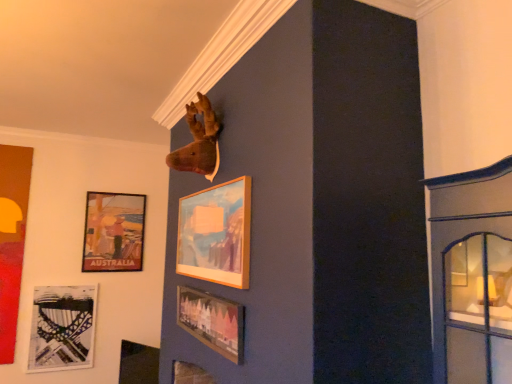
At what (x,y) coordinates should I click in order to perform the action: click on matte black picture frame at lower left, which is the 3th picture frame in back-to-front order. Please return your answer as a coordinate pair (x, y). This screenshot has height=384, width=512. Looking at the image, I should click on (138, 364).

Locate an element on the screen. This screenshot has height=384, width=512. matte black harp at lower left, the 4th picture frame in the front-to-back sequence is located at coordinates (62, 328).

What is the approximate height of wooden frame at upper center, which appears as the 4th picture frame when viewed from the back?

The height of wooden frame at upper center, which appears as the 4th picture frame when viewed from the back, is 19.84 inches.

Locate an element on the screen. matte wooden picture frame at lower center, which is the 1th picture frame from front to back is located at coordinates (212, 321).

You are a GUI agent. You are given a task and a screenshot of the screen. Output one action in this format:
    pyautogui.click(x=<x>, y=<y>)
    Task: Click on the matte cardboard poster at upper left, placed as the fifth picture frame when sorted from front to back
    The height and width of the screenshot is (384, 512).
    Given the screenshot: What is the action you would take?
    pyautogui.click(x=113, y=232)

In terms of height, does matte wooden picture frame at lower center, arranged as the 5th picture frame when viewed from the back, look taller or shorter compared to matte black picture frame at lower left, which is the 3th picture frame in back-to-front order?

Considering their sizes, matte wooden picture frame at lower center, arranged as the 5th picture frame when viewed from the back, has less height than matte black picture frame at lower left, which is the 3th picture frame in back-to-front order.

Between matte wooden picture frame at lower center, which is the 1th picture frame from front to back, and matte black picture frame at lower left, acting as the 3th picture frame starting from the front, which one appears on the right side from the viewer's perspective?

From the viewer's perspective, matte wooden picture frame at lower center, which is the 1th picture frame from front to back, appears more on the right side.

Measure the distance between matte wooden picture frame at lower center, arranged as the 5th picture frame when viewed from the back, and matte black picture frame at lower left, acting as the 3th picture frame starting from the front.

The distance of matte wooden picture frame at lower center, arranged as the 5th picture frame when viewed from the back, from matte black picture frame at lower left, acting as the 3th picture frame starting from the front, is 5.16 feet.

Can we say matte wooden picture frame at lower center, arranged as the 5th picture frame when viewed from the back, lies outside matte black picture frame at lower left, which is the 3th picture frame in back-to-front order?

Yes, matte wooden picture frame at lower center, arranged as the 5th picture frame when viewed from the back, is located beyond the bounds of matte black picture frame at lower left, which is the 3th picture frame in back-to-front order.

Is matte wooden picture frame at lower center, which is the 1th picture frame from front to back, placed right next to matte cardboard poster at upper left, placed as the fifth picture frame when sorted from front to back?

matte wooden picture frame at lower center, which is the 1th picture frame from front to back, and matte cardboard poster at upper left, placed as the fifth picture frame when sorted from front to back, are clearly separated.

Is matte wooden picture frame at lower center, which is the 1th picture frame from front to back, in front of or behind matte cardboard poster at upper left, placed as the fifth picture frame when sorted from front to back, in the image?

matte wooden picture frame at lower center, which is the 1th picture frame from front to back, is in front of matte cardboard poster at upper left, placed as the fifth picture frame when sorted from front to back.

At what (x,y) coordinates should I click in order to perform the action: click on the 2nd picture frame directly above the matte wooden picture frame at lower center, arranged as the 5th picture frame when viewed from the back (from a real-world perspective). Please return your answer as a coordinate pair (x, y). Looking at the image, I should click on (113, 232).

Can you confirm if matte wooden picture frame at lower center, arranged as the 5th picture frame when viewed from the back, is thinner than matte cardboard poster at upper left, the first picture frame positioned from the back?

Indeed, matte wooden picture frame at lower center, arranged as the 5th picture frame when viewed from the back, has a lesser width compared to matte cardboard poster at upper left, the first picture frame positioned from the back.

From the image's perspective, does matte black harp at lower left, the 4th picture frame in the front-to-back sequence, appear lower than wooden frame at upper center, the 2th picture frame viewed from the front?

Indeed, from the image's perspective, matte black harp at lower left, the 4th picture frame in the front-to-back sequence, is shown beneath wooden frame at upper center, the 2th picture frame viewed from the front.

Does matte black harp at lower left, the 4th picture frame in the front-to-back sequence, have a lesser width compared to wooden frame at upper center, the 2th picture frame viewed from the front?

In fact, matte black harp at lower left, the 4th picture frame in the front-to-back sequence, might be wider than wooden frame at upper center, the 2th picture frame viewed from the front.

Considering the points (80, 332) and (243, 230), which point is in front, point (80, 332) or point (243, 230)?

Positioned in front is point (243, 230).

Is wooden frame at upper center, which appears as the 4th picture frame when viewed from the back, a part of matte black harp at lower left, which is counted as the second picture frame, starting from the back?

No.

Looking at this image, from the image's perspective, is matte black harp at lower left, which is counted as the second picture frame, starting from the back, above matte black picture frame at lower left, which is the 3th picture frame in back-to-front order?

Yes, from the image's perspective, matte black harp at lower left, which is counted as the second picture frame, starting from the back, is above matte black picture frame at lower left, which is the 3th picture frame in back-to-front order.

Image resolution: width=512 pixels, height=384 pixels. What are the coordinates of `picture frame that is the 2nd one when counting leftward from the matte black picture frame at lower left, which is the 3th picture frame in back-to-front order` in the screenshot? It's located at (62, 328).

Does matte black harp at lower left, the 4th picture frame in the front-to-back sequence, have a greater height compared to matte black picture frame at lower left, which is the 3th picture frame in back-to-front order?

Indeed, matte black harp at lower left, the 4th picture frame in the front-to-back sequence, has a greater height compared to matte black picture frame at lower left, which is the 3th picture frame in back-to-front order.

Could you tell me if matte black harp at lower left, the 4th picture frame in the front-to-back sequence, is turned towards matte black picture frame at lower left, acting as the 3th picture frame starting from the front?

No.

Would you consider matte wooden picture frame at lower center, which is the 1th picture frame from front to back, to be distant from wooden frame at upper center, the 2th picture frame viewed from the front?

matte wooden picture frame at lower center, which is the 1th picture frame from front to back, is actually quite close to wooden frame at upper center, the 2th picture frame viewed from the front.

This screenshot has height=384, width=512. Find the location of `the 2nd picture frame below the wooden frame at upper center, which appears as the 4th picture frame when viewed from the back (from the image's perspective)`. the 2nd picture frame below the wooden frame at upper center, which appears as the 4th picture frame when viewed from the back (from the image's perspective) is located at coordinates (212, 321).

Is matte wooden picture frame at lower center, arranged as the 5th picture frame when viewed from the back, closer to the viewer compared to wooden frame at upper center, the 2th picture frame viewed from the front?

Yes, matte wooden picture frame at lower center, arranged as the 5th picture frame when viewed from the back, is in front of wooden frame at upper center, the 2th picture frame viewed from the front.

Considering the relative positions of matte wooden picture frame at lower center, arranged as the 5th picture frame when viewed from the back, and wooden frame at upper center, which appears as the 4th picture frame when viewed from the back, in the image provided, is matte wooden picture frame at lower center, arranged as the 5th picture frame when viewed from the back, to the right of wooden frame at upper center, which appears as the 4th picture frame when viewed from the back, from the viewer's perspective?

In fact, matte wooden picture frame at lower center, arranged as the 5th picture frame when viewed from the back, is to the left of wooden frame at upper center, which appears as the 4th picture frame when viewed from the back.

From a real-world perspective, is matte cardboard poster at upper left, placed as the fifth picture frame when sorted from front to back, on top of matte black harp at lower left, the 4th picture frame in the front-to-back sequence?

Correct, in the physical world, matte cardboard poster at upper left, placed as the fifth picture frame when sorted from front to back, is higher than matte black harp at lower left, the 4th picture frame in the front-to-back sequence.

Is matte cardboard poster at upper left, placed as the fifth picture frame when sorted from front to back, next to matte black harp at lower left, which is counted as the second picture frame, starting from the back, and touching it?

matte cardboard poster at upper left, placed as the fifth picture frame when sorted from front to back, and matte black harp at lower left, which is counted as the second picture frame, starting from the back, are not in contact.

Where is `the 2nd picture frame above the matte black harp at lower left, the 4th picture frame in the front-to-back sequence (from the image's perspective)`? The height and width of the screenshot is (384, 512). the 2nd picture frame above the matte black harp at lower left, the 4th picture frame in the front-to-back sequence (from the image's perspective) is located at coordinates (113, 232).

Between point (97, 194) and point (71, 328), which one is positioned behind?

The point (97, 194) is farther from the camera.

Considering the points (236, 261) and (215, 332), which point is in front, point (236, 261) or point (215, 332)?

The point (236, 261) is more forward.

Measure the distance from wooden frame at upper center, the 2th picture frame viewed from the front, to matte wooden picture frame at lower center, which is the 1th picture frame from front to back.

wooden frame at upper center, the 2th picture frame viewed from the front, and matte wooden picture frame at lower center, which is the 1th picture frame from front to back, are 10.27 inches apart.

Is wooden frame at upper center, the 2th picture frame viewed from the front, positioned beyond the bounds of matte wooden picture frame at lower center, which is the 1th picture frame from front to back?

Yes, wooden frame at upper center, the 2th picture frame viewed from the front, is located beyond the bounds of matte wooden picture frame at lower center, which is the 1th picture frame from front to back.

Are wooden frame at upper center, which appears as the 4th picture frame when viewed from the back, and matte wooden picture frame at lower center, arranged as the 5th picture frame when viewed from the back, far apart?

No, wooden frame at upper center, which appears as the 4th picture frame when viewed from the back, is not far away from matte wooden picture frame at lower center, arranged as the 5th picture frame when viewed from the back.

At what (x,y) coordinates should I click in order to perform the action: click on the 2nd picture frame in front when counting from the matte black picture frame at lower left, acting as the 3th picture frame starting from the front. Please return your answer as a coordinate pair (x, y). The height and width of the screenshot is (384, 512). Looking at the image, I should click on (212, 321).

Which picture frame is the 2nd one when counting from the left side of the matte wooden picture frame at lower center, arranged as the 5th picture frame when viewed from the back? Please provide its 2D coordinates.

[(113, 232)]

Which object lies nearer to the anchor point matte cardboard poster at upper left, placed as the fifth picture frame when sorted from front to back, wooden frame at upper center, which appears as the 4th picture frame when viewed from the back, or matte black picture frame at lower left, which is the 3th picture frame in back-to-front order?

matte black picture frame at lower left, which is the 3th picture frame in back-to-front order, is positioned closer to the anchor matte cardboard poster at upper left, placed as the fifth picture frame when sorted from front to back.

Looking at the image, which one is located further to matte black harp at lower left, which is counted as the second picture frame, starting from the back, matte black picture frame at lower left, acting as the 3th picture frame starting from the front, or matte cardboard poster at upper left, the first picture frame positioned from the back?

Among the two, matte cardboard poster at upper left, the first picture frame positioned from the back, is located further to matte black harp at lower left, which is counted as the second picture frame, starting from the back.

Which object lies nearer to the anchor point matte black picture frame at lower left, which is the 3th picture frame in back-to-front order, wooden frame at upper center, the 2th picture frame viewed from the front, or matte wooden picture frame at lower center, which is the 1th picture frame from front to back?

Among the two, matte wooden picture frame at lower center, which is the 1th picture frame from front to back, is located nearer to matte black picture frame at lower left, which is the 3th picture frame in back-to-front order.

Looking at the image, which one is located closer to wooden frame at upper center, the 2th picture frame viewed from the front, matte black picture frame at lower left, acting as the 3th picture frame starting from the front, or matte wooden picture frame at lower center, which is the 1th picture frame from front to back?

matte wooden picture frame at lower center, which is the 1th picture frame from front to back, is closer to wooden frame at upper center, the 2th picture frame viewed from the front.

When comparing their distances from wooden frame at upper center, which appears as the 4th picture frame when viewed from the back, does matte wooden picture frame at lower center, arranged as the 5th picture frame when viewed from the back, or matte black picture frame at lower left, which is the 3th picture frame in back-to-front order, seem further?

matte black picture frame at lower left, which is the 3th picture frame in back-to-front order, lies further to wooden frame at upper center, which appears as the 4th picture frame when viewed from the back, than the other object.

From the image, which object appears to be nearer to wooden frame at upper center, which appears as the 4th picture frame when viewed from the back, matte wooden picture frame at lower center, which is the 1th picture frame from front to back, or matte black harp at lower left, the 4th picture frame in the front-to-back sequence?

matte wooden picture frame at lower center, which is the 1th picture frame from front to back, is closer to wooden frame at upper center, which appears as the 4th picture frame when viewed from the back.

Based on their spatial positions, is matte black harp at lower left, which is counted as the second picture frame, starting from the back, or matte wooden picture frame at lower center, arranged as the 5th picture frame when viewed from the back, closer to matte cardboard poster at upper left, the first picture frame positioned from the back?

matte black harp at lower left, which is counted as the second picture frame, starting from the back.

From the image, which object appears to be farther from matte black harp at lower left, the 4th picture frame in the front-to-back sequence, matte wooden picture frame at lower center, arranged as the 5th picture frame when viewed from the back, or matte black picture frame at lower left, acting as the 3th picture frame starting from the front?

The object further to matte black harp at lower left, the 4th picture frame in the front-to-back sequence, is matte wooden picture frame at lower center, arranged as the 5th picture frame when viewed from the back.

The width and height of the screenshot is (512, 384). Identify the location of picture frame between matte wooden picture frame at lower center, which is the 1th picture frame from front to back, and matte black picture frame at lower left, which is the 3th picture frame in back-to-front order, in the front-back direction. (216, 234).

Identify the location of picture frame between wooden frame at upper center, which appears as the 4th picture frame when viewed from the back, and matte black harp at lower left, the 4th picture frame in the front-to-back sequence, from front to back. (138, 364).